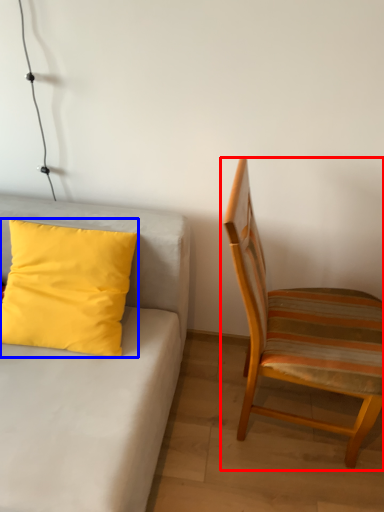
Question: Which object appears closest to the camera in this image, chair (highlighted by a red box) or pillow (highlighted by a blue box)?

Choices:
 (A) chair
 (B) pillow

Answer: (A)